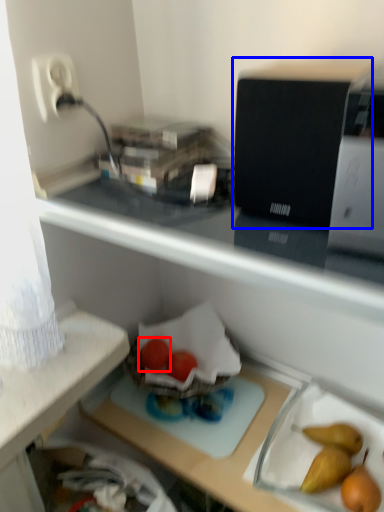
Question: Which object appears farthest to the camera in this image, green vegetables (highlighted by a red box) or appliance (highlighted by a blue box)?

Choices:
 (A) green vegetables
 (B) appliance

Answer: (A)